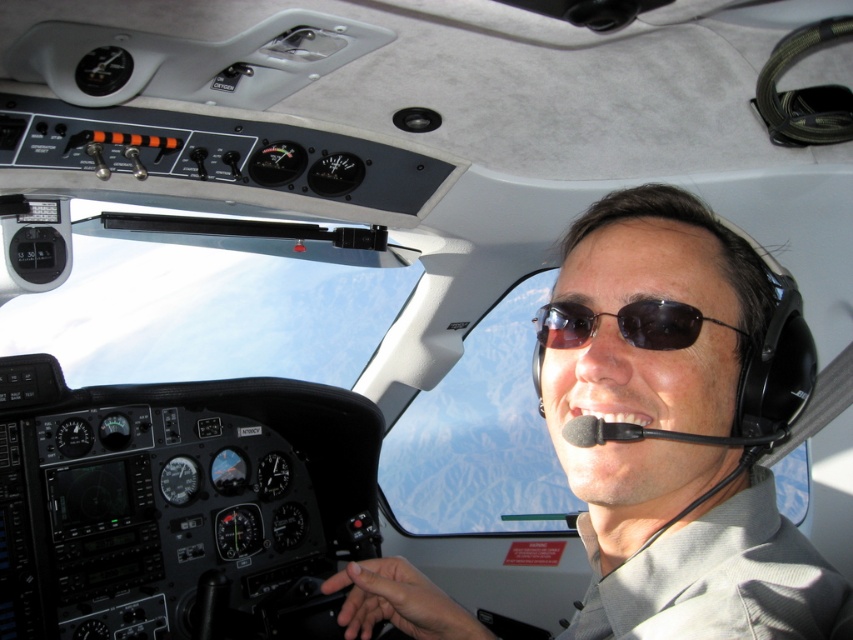
Can you confirm if sunglasses at center is positioned to the right of black matte sunglasses at center?

No, sunglasses at center is not to the right of black matte sunglasses at center.

Is sunglasses at center above black matte sunglasses at center?

Actually, sunglasses at center is below black matte sunglasses at center.

Does point (614, 262) come farther from viewer compared to point (566, 333)?

No, (614, 262) is closer to viewer.

You are a GUI agent. You are given a task and a screenshot of the screen. Output one action in this format:
    pyautogui.click(x=<x>, y=<y>)
    Task: Click on the sunglasses at center
    This screenshot has height=640, width=853.
    Given the screenshot: What is the action you would take?
    pyautogui.click(x=672, y=429)